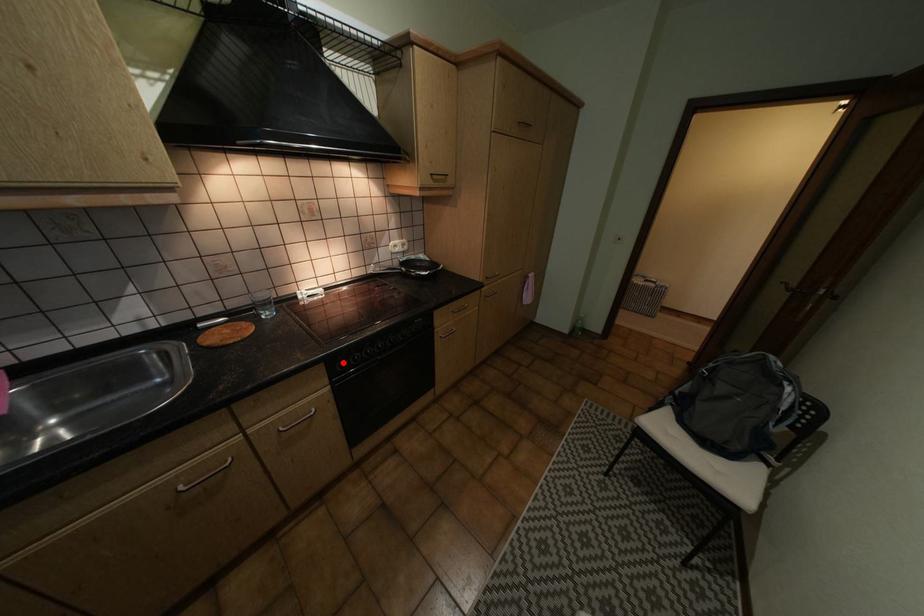
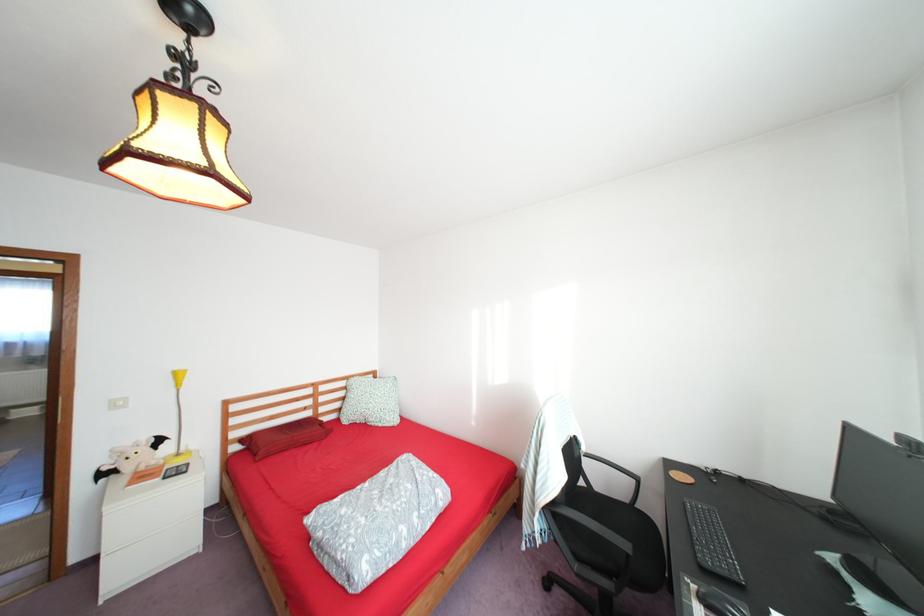
Question: I am providing you with two images of the same scene from different viewpoints. A red point is marked on the first image. At the location where the point appears in image 1, is it still visible in image 2?

Choices:
 (A) Yes
 (B) No

Answer: (B)